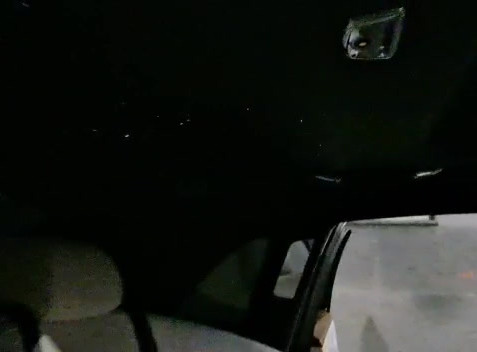
You are a GUI agent. You are given a task and a screenshot of the screen. Output one action in this format:
    pyautogui.click(x=<x>, y=<y>)
    Task: Click on the rod
    
    Given the screenshot: What is the action you would take?
    pyautogui.click(x=339, y=276)